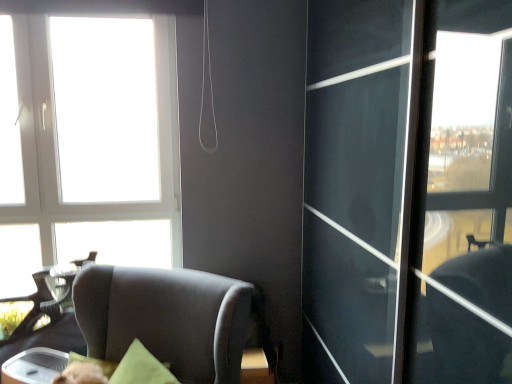
Question: Can you see suede-like brown chair at lower left touching white plastic window at upper left?

Choices:
 (A) yes
 (B) no

Answer: (B)

Question: Is suede-like brown chair at lower left far away from white plastic window at upper left?

Choices:
 (A) yes
 (B) no

Answer: (B)

Question: Does suede-like brown chair at lower left appear on the left side of white plastic window at upper left?

Choices:
 (A) no
 (B) yes

Answer: (A)

Question: Is suede-like brown chair at lower left positioned with its back to white plastic window at upper left?

Choices:
 (A) no
 (B) yes

Answer: (A)

Question: From the image's perspective, is suede-like brown chair at lower left on top of white plastic window at upper left?

Choices:
 (A) no
 (B) yes

Answer: (A)

Question: Does suede-like brown chair at lower left have a greater height compared to white plastic window at upper left?

Choices:
 (A) yes
 (B) no

Answer: (B)

Question: Would you consider white plastic window at upper left to be distant from suede-like brown chair at lower left?

Choices:
 (A) yes
 (B) no

Answer: (B)

Question: Considering the relative sizes of white plastic window at upper left and suede-like brown chair at lower left in the image provided, is white plastic window at upper left bigger than suede-like brown chair at lower left?

Choices:
 (A) yes
 (B) no

Answer: (B)

Question: From the image's perspective, is white plastic window at upper left above suede-like brown chair at lower left?

Choices:
 (A) no
 (B) yes

Answer: (B)

Question: From a real-world perspective, does white plastic window at upper left stand above suede-like brown chair at lower left?

Choices:
 (A) yes
 (B) no

Answer: (A)

Question: Is white plastic window at upper left at the left side of suede-like brown chair at lower left?

Choices:
 (A) yes
 (B) no

Answer: (A)

Question: Is white plastic window at upper left further to the viewer compared to suede-like brown chair at lower left?

Choices:
 (A) no
 (B) yes

Answer: (B)

Question: Would you say white plastic window at upper left is inside or outside suede-like brown chair at lower left?

Choices:
 (A) outside
 (B) inside

Answer: (A)